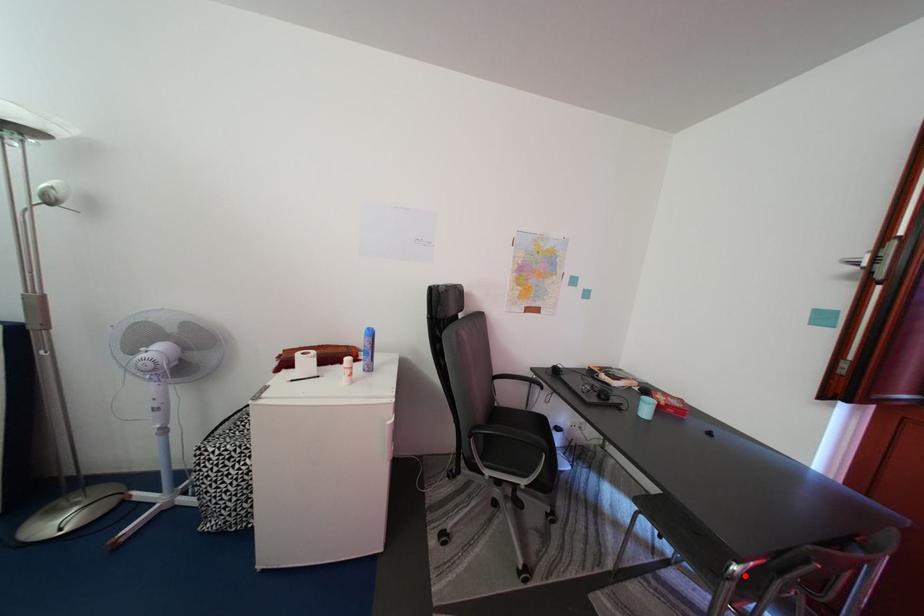
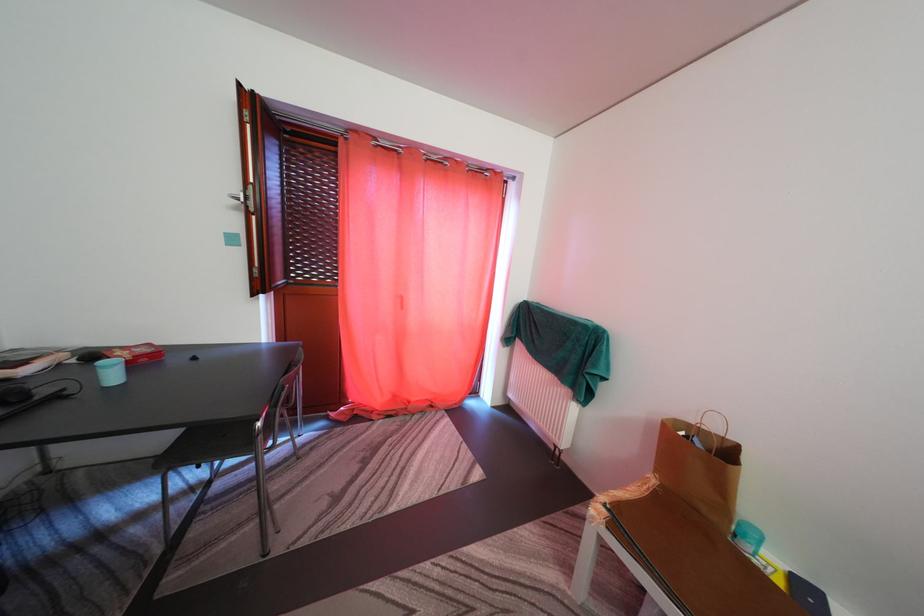
Question: I am providing you with two images of the same scene from different viewpoints. A red point is shown in image1. For the corresponding object point in image2, is it positioned nearer or farther from the camera?

Choices:
 (A) Nearer
 (B) Farther

Answer: (B)